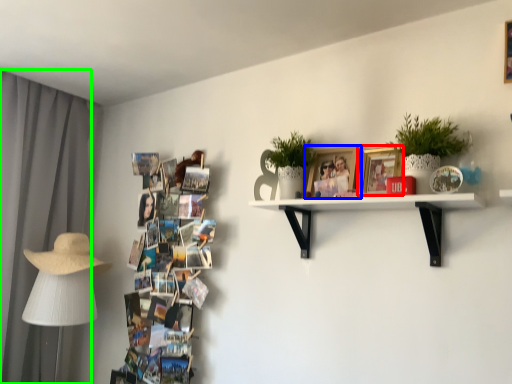
Question: Which object is positioned closest to picture frame (highlighted by a red box)? Select from picture frame (highlighted by a blue box) and curtain (highlighted by a green box).

Choices:
 (A) picture frame
 (B) curtain

Answer: (A)